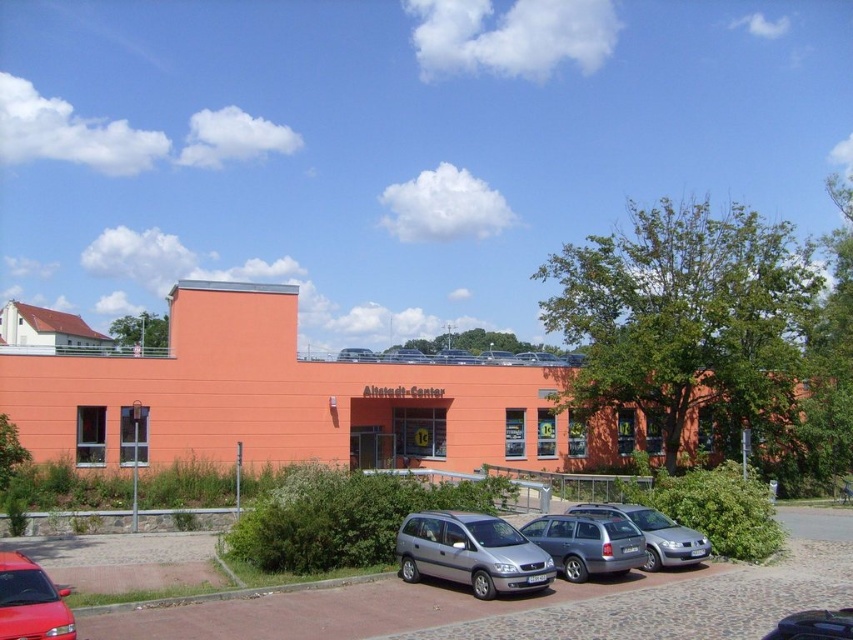
Question: Can you confirm if silver metallic car at lower center is wider than satin silver minivan at center?

Choices:
 (A) no
 (B) yes

Answer: (B)

Question: Considering the relative positions of silver metallic car at lower center and shiny red car at lower left in the image provided, where is silver metallic car at lower center located with respect to shiny red car at lower left?

Choices:
 (A) above
 (B) below

Answer: (B)

Question: Which of these objects is positioned farthest from the shiny red car at lower left?

Choices:
 (A) silver metallic hatchback at lower right
 (B) silver metallic station wagon at center
 (C) satin silver minivan at center

Answer: (A)

Question: Which of the following is the farthest from the observer?

Choices:
 (A) silver metallic station wagon at center
 (B) shiny red car at lower left

Answer: (A)

Question: Among these objects, which one is nearest to the camera?

Choices:
 (A) shiny red car at lower left
 (B) silver metallic car at lower center
 (C) satin silver minivan at center
 (D) silver metallic station wagon at center

Answer: (A)

Question: Is silver metallic car at lower center thinner than satin silver minivan at center?

Choices:
 (A) yes
 (B) no

Answer: (B)